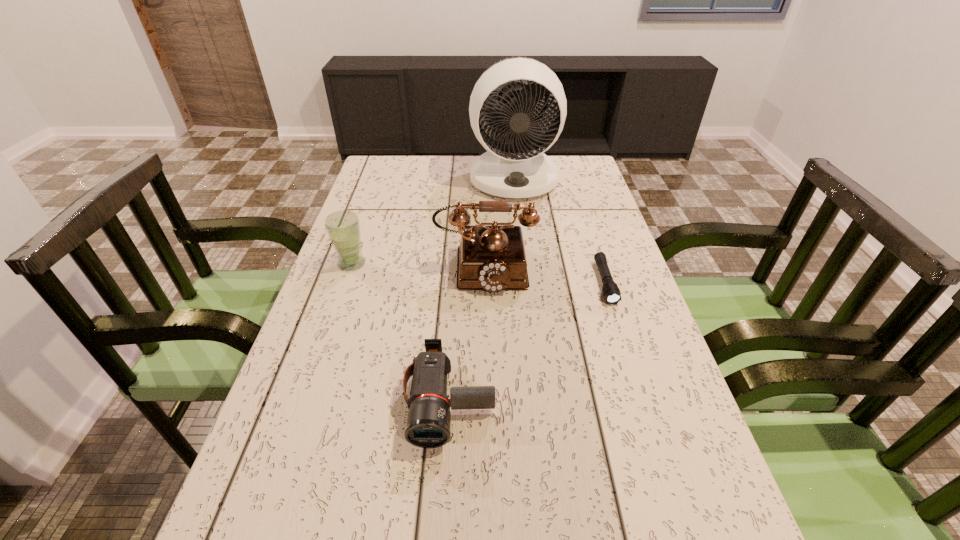
Locate an element on the screen. The height and width of the screenshot is (540, 960). free space at the left edge is located at coordinates (343, 383).

Where is `free space at the right edge of the desktop`? This screenshot has width=960, height=540. free space at the right edge of the desktop is located at coordinates (627, 409).

Locate an element on the screen. This screenshot has width=960, height=540. free space between the farthest object and the flashlight is located at coordinates [x=560, y=231].

I want to click on free spot between the glass and the telephone, so click(x=419, y=265).

In order to click on free point between the flashlight and the second tallest object in this screenshot , I will do `click(544, 274)`.

Where is `vacant area between the rightmost object and the fourth tallest object`? This screenshot has height=540, width=960. vacant area between the rightmost object and the fourth tallest object is located at coordinates coord(527,341).

Point out which object is positioned as the second nearest to the leftmost object. Please provide its 2D coordinates. Your answer should be formatted as a tuple, i.e. [(x, y)], where the tuple contains the x and y coordinates of a point satisfying the conditions above.

[(428, 424)]

Identify which object is located as the nearest to the second shortest object. Please provide its 2D coordinates. Your answer should be formatted as a tuple, i.e. [(x, y)], where the tuple contains the x and y coordinates of a point satisfying the conditions above.

[(492, 258)]